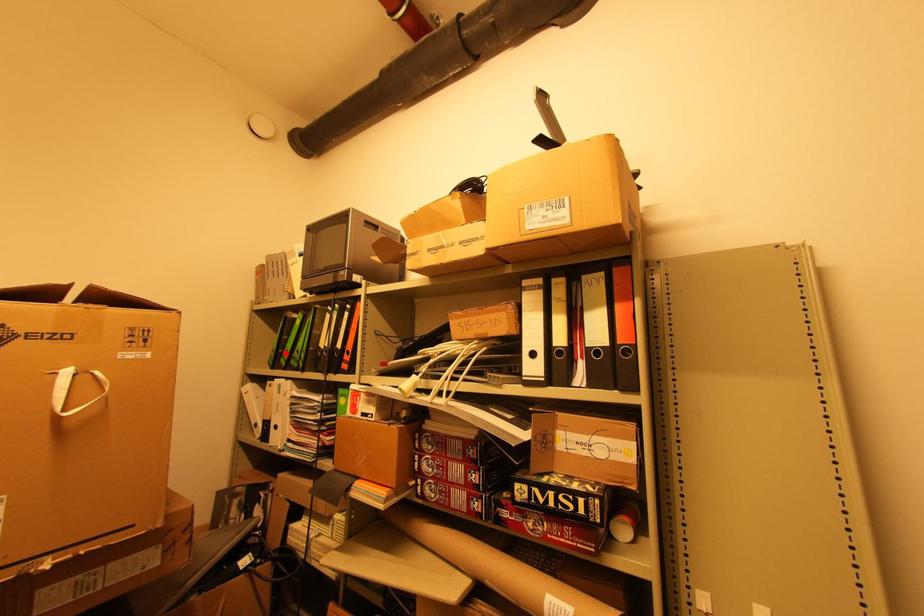
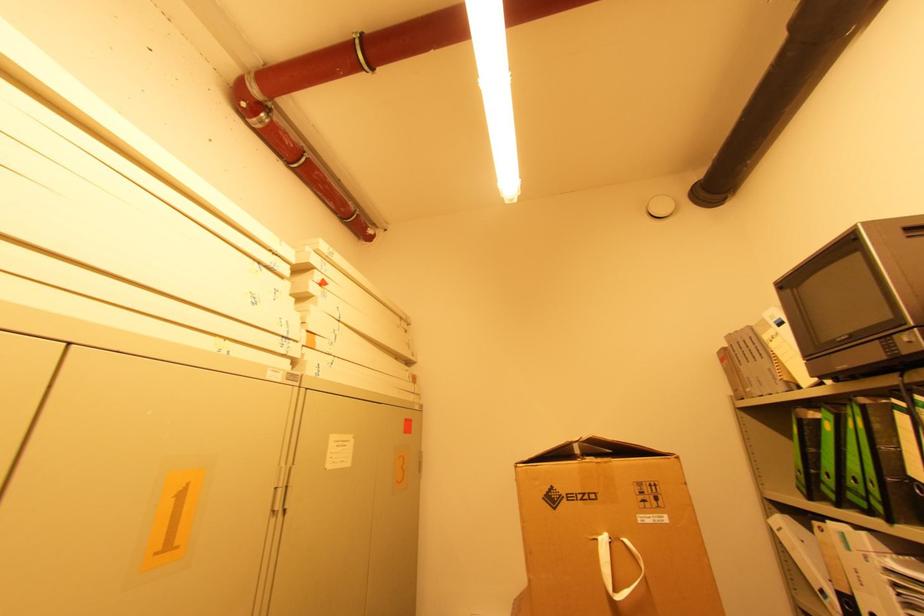
The point at the highlighted location is marked in the first image. Where is the corresponding point in the second image?

(822, 476)